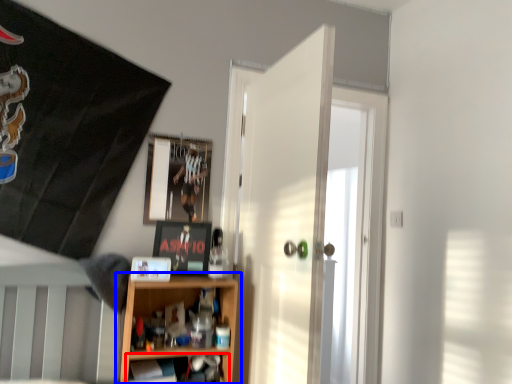
Question: Which of the following is the farthest to the observer, shelf (highlighted by a red box) or shelf (highlighted by a blue box)?

Choices:
 (A) shelf
 (B) shelf

Answer: (B)